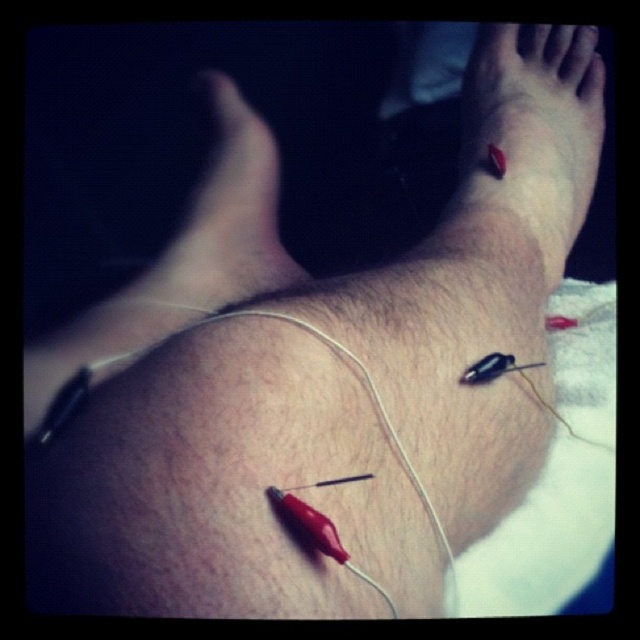
Can you confirm if red rubber band at upper right is positioned to the left of matte skin foot at center?

In fact, red rubber band at upper right is to the right of matte skin foot at center.

Locate an element on the screen. red rubber band at upper right is located at coordinates (534, 131).

The width and height of the screenshot is (640, 640). In order to click on red rubber band at upper right in this screenshot , I will do `click(534, 131)`.